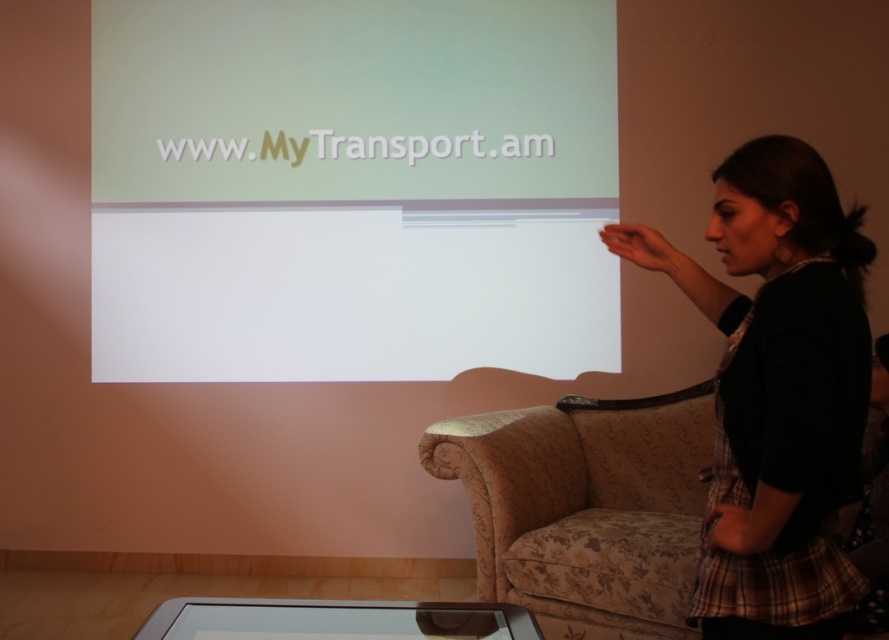
Based on the photo, you are sitting in the audience facing the presentation screen. There are two points marked on the screen. The first point is at coordinates point (x=725, y=397) and the second is at point (x=534, y=428). Which point would appear closer to you?

Point (x=725, y=397) is in front of point (x=534, y=428), so it would appear closer to you.

You are sitting on the patterned fabric couch at lower right and want to place a book on the black fabric at right. Can you reach it without moving from the couch?

The black fabric at right is to the right of the patterned fabric couch at lower right, so you can reach it from the couch without needing to move.

You are an attendee at the presentation and want to take a photo of the white glossy projection screen at upper center without the black fabric at right appearing in the frame. Where should you position yourself relative to the screen?

To avoid capturing the black fabric at right in your photo, position yourself to the left of the white glossy projection screen at upper center since it is located to the left of the black fabric at right.